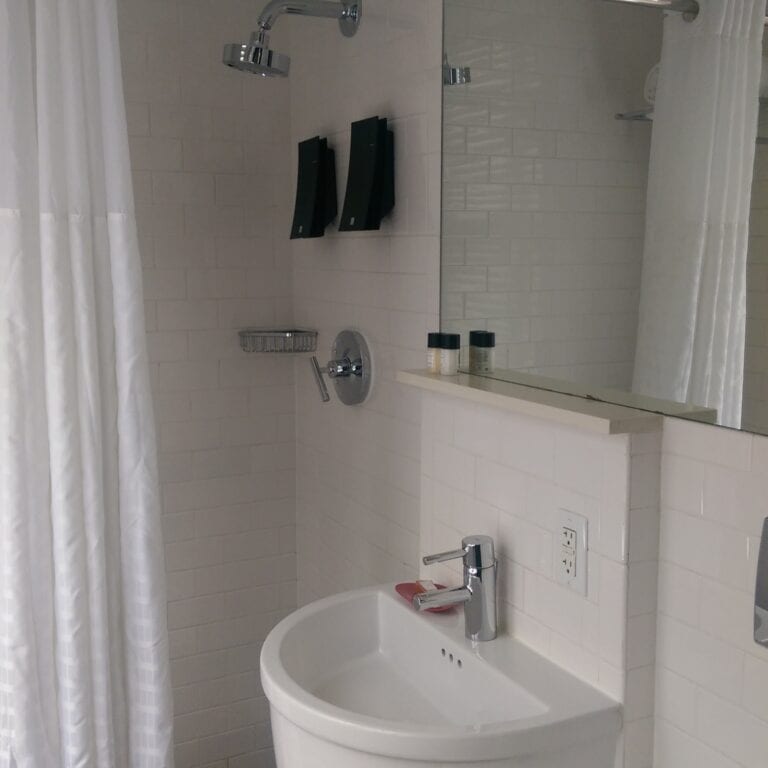
Identify the location of red plate. Image resolution: width=768 pixels, height=768 pixels. (409, 596).